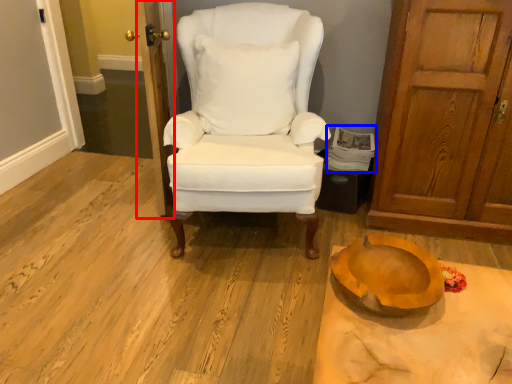
Question: Which of the following is the closest to the observer, door (highlighted by a red box) or magazine (highlighted by a blue box)?

Choices:
 (A) door
 (B) magazine

Answer: (A)